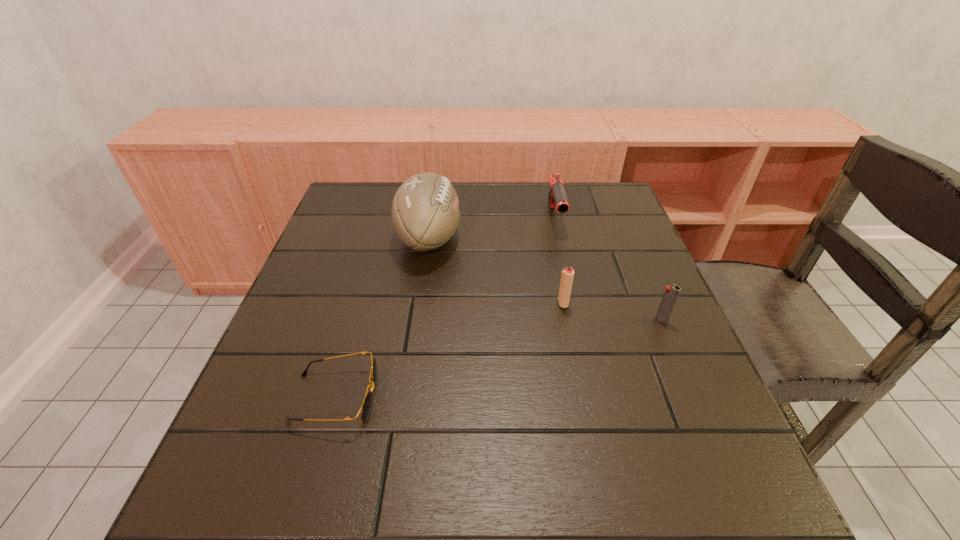
The height and width of the screenshot is (540, 960). In order to click on free space located on the right of the farther igniter in this screenshot , I will do `click(668, 303)`.

Find the location of a particular element. The height and width of the screenshot is (540, 960). vacant area located 0.260m on the back of the right igniter is located at coordinates (629, 244).

Find the location of `vacant point located 0.100m on the front-facing side of the nearest object`. vacant point located 0.100m on the front-facing side of the nearest object is located at coordinates (432, 398).

Image resolution: width=960 pixels, height=540 pixels. Find the location of `football (American) positioned at the far edge`. football (American) positioned at the far edge is located at coordinates (425, 211).

Find the location of `gun located at the far edge`. gun located at the far edge is located at coordinates (557, 196).

The height and width of the screenshot is (540, 960). Find the location of `object at the left edge`. object at the left edge is located at coordinates (366, 407).

Image resolution: width=960 pixels, height=540 pixels. I want to click on object positioned at the right edge, so pyautogui.click(x=671, y=293).

The width and height of the screenshot is (960, 540). Find the location of `blank space at the far edge of the desktop`. blank space at the far edge of the desktop is located at coordinates [530, 187].

You are a GUI agent. You are given a task and a screenshot of the screen. Output one action in this format:
    pyautogui.click(x=<x>, y=<y>)
    Task: Click on the blank space at the near edge of the desktop
    The image size is (960, 540).
    Given the screenshot: What is the action you would take?
    tap(373, 506)

I want to click on vacant space at the left edge of the desktop, so click(x=272, y=357).